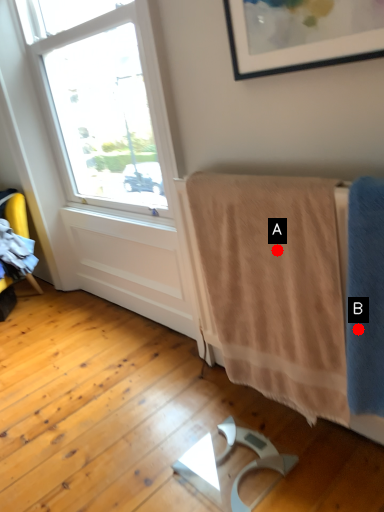
Question: Two points are circled on the image, labeled by A and B beside each circle. Which point is farther to the camera?

Choices:
 (A) A is further
 (B) B is further

Answer: (A)